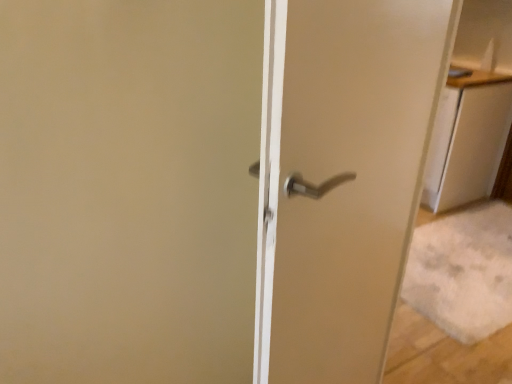
Question: Does point (364, 304) appear closer or farther from the camera than point (437, 163)?

Choices:
 (A) closer
 (B) farther

Answer: (A)

Question: From the image's perspective, relative to white glossy cabinet at upper right, is satin silver handle at center above or below?

Choices:
 (A) above
 (B) below

Answer: (B)

Question: In terms of height, does satin silver handle at center look taller or shorter compared to white glossy cabinet at upper right?

Choices:
 (A) tall
 (B) short

Answer: (A)

Question: Is white glossy cabinet at upper right bigger or smaller than satin silver handle at center?

Choices:
 (A) big
 (B) small

Answer: (B)

Question: In the image, is white glossy cabinet at upper right positioned in front of or behind satin silver handle at center?

Choices:
 (A) behind
 (B) front

Answer: (A)

Question: Visually, is white glossy cabinet at upper right positioned to the left or to the right of satin silver handle at center?

Choices:
 (A) right
 (B) left

Answer: (A)

Question: From a real-world perspective, is white glossy cabinet at upper right positioned above or below satin silver handle at center?

Choices:
 (A) above
 (B) below

Answer: (B)